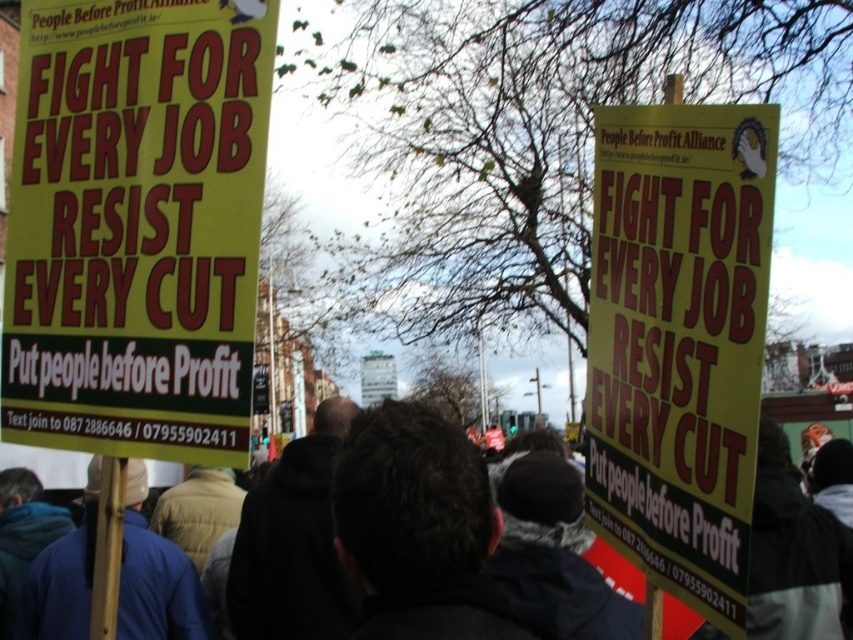
Can you confirm if yellow paper sign at left is wider than yellow paper sign at center?

Correct, the width of yellow paper sign at left exceeds that of yellow paper sign at center.

Who is positioned more to the right, yellow paper sign at left or yellow paper sign at center?

yellow paper sign at center is more to the right.

What do you see at coordinates (136, 225) in the screenshot? The image size is (853, 640). I see `yellow paper sign at left` at bounding box center [136, 225].

Identify the location of yellow paper sign at left. Image resolution: width=853 pixels, height=640 pixels. coord(136,225).